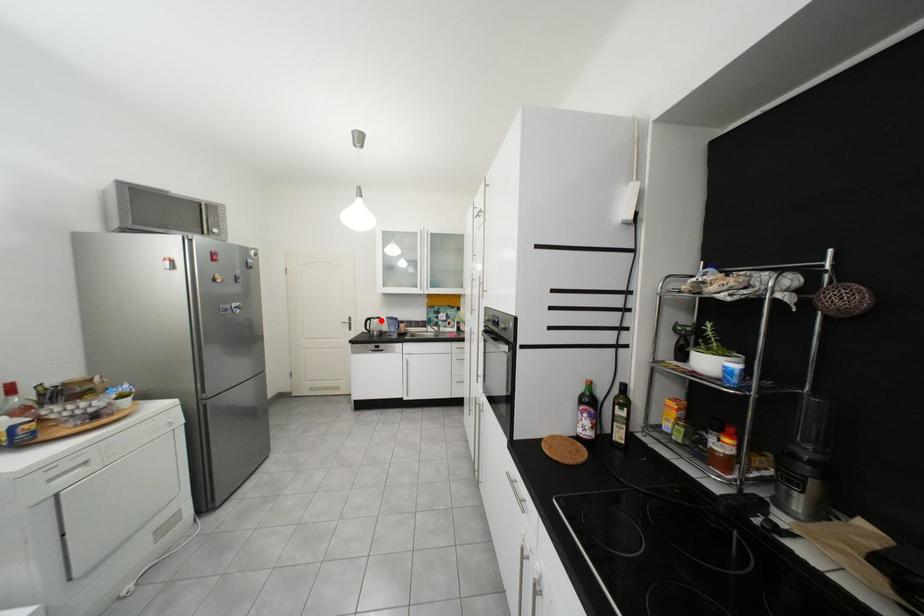
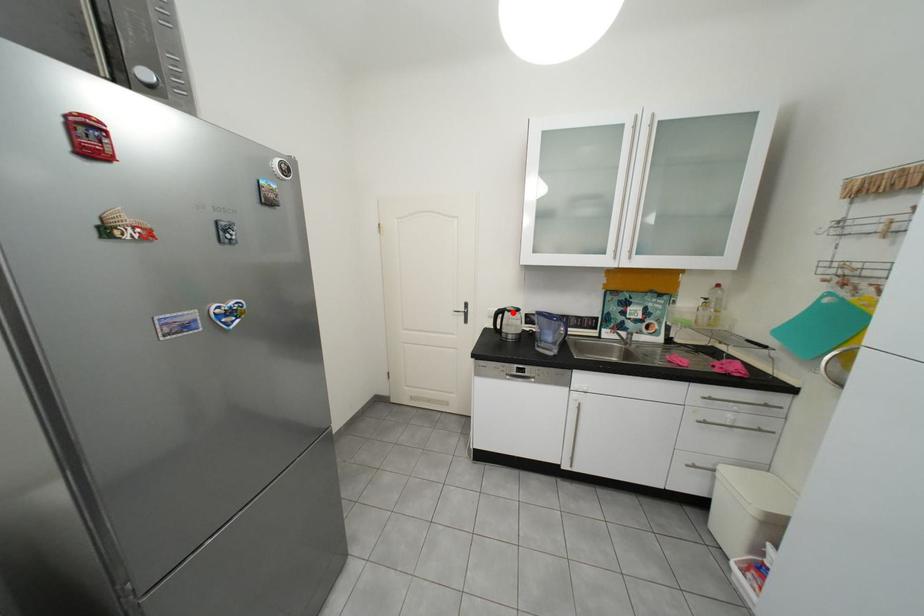
I am providing you with two images of the same scene from different viewpoints. A red point is marked on the first image and another point is marked on the second image. Is the marked point in image1 the same physical position as the marked point in image2?

Yes